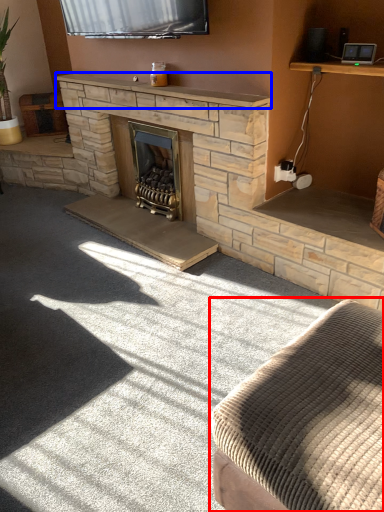
Question: Among these objects, which one is farthest to the camera, studio couch (highlighted by a red box) or mantle (highlighted by a blue box)?

Choices:
 (A) studio couch
 (B) mantle

Answer: (B)